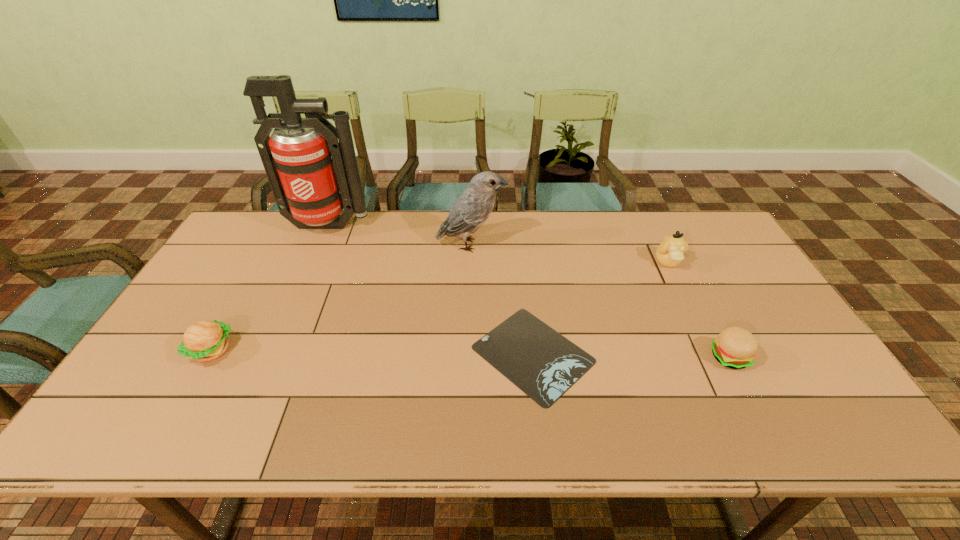
At what (x,y) coordinates should I click in order to perform the action: click on free region at the right edge. Please return your answer as a coordinate pair (x, y). The image size is (960, 540). Looking at the image, I should click on (780, 355).

Locate an element on the screen. blank space at the far left corner of the desktop is located at coordinates (270, 215).

Identify the location of unoccupied area between the second tallest object and the left hamburger. (342, 298).

The width and height of the screenshot is (960, 540). I want to click on free space between the fourth shortest object and the fifth shortest object, so click(x=569, y=253).

Identify the location of vacant space that is in between the right hamburger and the tallest object. This screenshot has height=540, width=960. (529, 291).

Locate an element on the screen. The height and width of the screenshot is (540, 960). vacant area between the fourth shortest object and the left hamburger is located at coordinates (440, 306).

I want to click on unoccupied area between the fire extinguisher and the left hamburger, so tap(271, 288).

Locate an element on the screen. free spot between the fire extinguisher and the third tallest object is located at coordinates (498, 244).

This screenshot has height=540, width=960. Find the location of `unoccupied area between the mousepad and the left hamburger`. unoccupied area between the mousepad and the left hamburger is located at coordinates (372, 352).

At what (x,y) coordinates should I click in order to perform the action: click on empty space that is in between the fire extinguisher and the right hamburger. Please return your answer as a coordinate pair (x, y). Looking at the image, I should click on (529, 291).